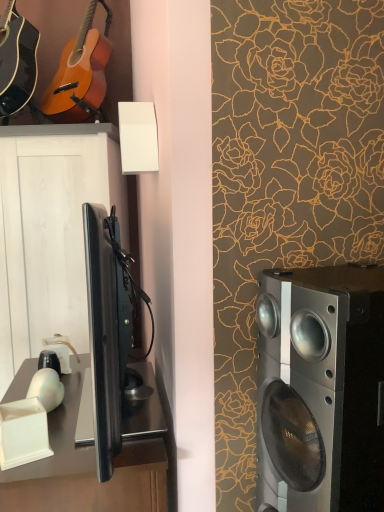
What do you see at coordinates (80, 74) in the screenshot? The height and width of the screenshot is (512, 384). I see `matte orange wood guitar at upper left, which is the 1th guitar from right to left` at bounding box center [80, 74].

The image size is (384, 512). Describe the element at coordinates (17, 61) in the screenshot. I see `matte black acoustic guitar at upper left, which is counted as the second guitar, starting from the right` at that location.

You are a GUI agent. You are given a task and a screenshot of the screen. Output one action in this format:
    pyautogui.click(x=<x>, y=<y>)
    Task: Click on the silver metallic speaker at right
    
    Given the screenshot: What is the action you would take?
    pyautogui.click(x=320, y=389)

Describe the element at coordinates (320, 389) in the screenshot. This screenshot has height=512, width=384. I see `silver metallic speaker at right` at that location.

Locate an element on the screen. satin black desk at lower left is located at coordinates pyautogui.click(x=86, y=468).

Does matte orange wood guitar at upper left, which is the 1th guitar from right to left, have a greater height compared to satin black desk at lower left?

In fact, matte orange wood guitar at upper left, which is the 1th guitar from right to left, may be shorter than satin black desk at lower left.

Does matte orange wood guitar at upper left, which is the 1th guitar from right to left, touch satin black desk at lower left?

matte orange wood guitar at upper left, which is the 1th guitar from right to left, is not next to satin black desk at lower left, and they're not touching.

Between matte orange wood guitar at upper left, the 2th guitar positioned from the left, and satin black desk at lower left, which one has smaller size?

matte orange wood guitar at upper left, the 2th guitar positioned from the left, is smaller.

Is matte orange wood guitar at upper left, the 2th guitar positioned from the left, inside or outside of satin black desk at lower left?

matte orange wood guitar at upper left, the 2th guitar positioned from the left, cannot be found inside satin black desk at lower left.

Based on the photo, is black glossy cabinet at left turned away from matte orange wood guitar at upper left, the 2th guitar positioned from the left?

No.

Is black glossy cabinet at left next to matte orange wood guitar at upper left, which is the 1th guitar from right to left, and touching it?

No, black glossy cabinet at left is not making contact with matte orange wood guitar at upper left, which is the 1th guitar from right to left.

Which object is closer to the camera, black glossy cabinet at left or matte orange wood guitar at upper left, the 2th guitar positioned from the left?

matte orange wood guitar at upper left, the 2th guitar positioned from the left, is in front.

Looking at the image, does black glossy cabinet at left seem bigger or smaller compared to matte orange wood guitar at upper left, which is the 1th guitar from right to left?

black glossy cabinet at left is bigger than matte orange wood guitar at upper left, which is the 1th guitar from right to left.

Is satin black desk at lower left turned away from silver metallic speaker at right?

Yes, satin black desk at lower left is facing away from silver metallic speaker at right.

Between satin black desk at lower left and silver metallic speaker at right, which one has larger width?

Wider between the two is satin black desk at lower left.

Would you say satin black desk at lower left is inside or outside silver metallic speaker at right?

satin black desk at lower left is spatially situated outside silver metallic speaker at right.

From the picture: Does satin black desk at lower left appear on the right side of silver metallic speaker at right?

No, satin black desk at lower left is not to the right of silver metallic speaker at right.

From a real-world perspective, who is located lower, satin black desk at lower left or black glossy cabinet at left?

satin black desk at lower left is physically lower.

Where is `cabinetry above the satin black desk at lower left (from the image's perspective)`? Image resolution: width=384 pixels, height=512 pixels. cabinetry above the satin black desk at lower left (from the image's perspective) is located at coordinates (50, 233).

Is satin black desk at lower left in contact with black glossy cabinet at left?

No, satin black desk at lower left is not making contact with black glossy cabinet at left.

Who is smaller, satin black desk at lower left or black glossy cabinet at left?

With smaller size is satin black desk at lower left.

From the image's perspective, between matte black acoustic guitar at upper left, marked as the first guitar in a left-to-right arrangement, and satin black desk at lower left, who is located below?

satin black desk at lower left, from the image's perspective.

In order to click on the 1st guitar behind the satin black desk at lower left, starting your count from the anchor in this screenshot , I will do `click(17, 61)`.

Is matte black acoustic guitar at upper left, marked as the first guitar in a left-to-right arrangement, positioned beyond the bounds of satin black desk at lower left?

Yes, matte black acoustic guitar at upper left, marked as the first guitar in a left-to-right arrangement, is not within satin black desk at lower left.

Is satin black desk at lower left at the back of matte black acoustic guitar at upper left, which is counted as the second guitar, starting from the right?

matte black acoustic guitar at upper left, which is counted as the second guitar, starting from the right, is not turned away from satin black desk at lower left.

Considering the sizes of objects matte orange wood guitar at upper left, which is the 1th guitar from right to left, and black glossy cabinet at left in the image provided, who is smaller, matte orange wood guitar at upper left, which is the 1th guitar from right to left, or black glossy cabinet at left?

matte orange wood guitar at upper left, which is the 1th guitar from right to left.

Does matte orange wood guitar at upper left, the 2th guitar positioned from the left, have a lesser height compared to black glossy cabinet at left?

Correct, matte orange wood guitar at upper left, the 2th guitar positioned from the left, is not as tall as black glossy cabinet at left.

How many degrees apart are the facing directions of matte orange wood guitar at upper left, which is the 1th guitar from right to left, and black glossy cabinet at left?

matte orange wood guitar at upper left, which is the 1th guitar from right to left, and black glossy cabinet at left are facing 1.27 degrees away from each other.

Which is behind, point (100, 45) or point (96, 164)?

The point (100, 45) is more distant.

From a real-world perspective, is matte orange wood guitar at upper left, which is the 1th guitar from right to left, physically located above or below matte black acoustic guitar at upper left, marked as the first guitar in a left-to-right arrangement?

matte orange wood guitar at upper left, which is the 1th guitar from right to left, is situated higher than matte black acoustic guitar at upper left, marked as the first guitar in a left-to-right arrangement, in the real world.

In terms of height, does matte orange wood guitar at upper left, the 2th guitar positioned from the left, look taller or shorter compared to matte black acoustic guitar at upper left, marked as the first guitar in a left-to-right arrangement?

In the image, matte orange wood guitar at upper left, the 2th guitar positioned from the left, appears to be taller than matte black acoustic guitar at upper left, marked as the first guitar in a left-to-right arrangement.

How much distance is there between matte orange wood guitar at upper left, which is the 1th guitar from right to left, and matte black acoustic guitar at upper left, marked as the first guitar in a left-to-right arrangement?

matte orange wood guitar at upper left, which is the 1th guitar from right to left, and matte black acoustic guitar at upper left, marked as the first guitar in a left-to-right arrangement, are 22.10 centimeters apart.

Is matte orange wood guitar at upper left, the 2th guitar positioned from the left, oriented away from matte black acoustic guitar at upper left, marked as the first guitar in a left-to-right arrangement?

No, matte orange wood guitar at upper left, the 2th guitar positioned from the left, is not facing away from matte black acoustic guitar at upper left, marked as the first guitar in a left-to-right arrangement.

Where is `the 2nd guitar located above the satin black desk at lower left (from a real-world perspective)`? This screenshot has width=384, height=512. the 2nd guitar located above the satin black desk at lower left (from a real-world perspective) is located at coordinates (80, 74).

The width and height of the screenshot is (384, 512). There is a black glossy cabinet at left. In order to click on the 2nd guitar above it (from the image's perspective) in this screenshot , I will do `click(80, 74)`.

Which object lies nearer to the anchor point matte orange wood guitar at upper left, which is the 1th guitar from right to left, satin black desk at lower left or silver metallic speaker at right?

satin black desk at lower left lies closer to matte orange wood guitar at upper left, which is the 1th guitar from right to left, than the other object.

When comparing their distances from satin black desk at lower left, does silver metallic speaker at right or black glossy cabinet at left seem closer?

silver metallic speaker at right is positioned closer to the anchor satin black desk at lower left.

Considering their positions, is matte orange wood guitar at upper left, which is the 1th guitar from right to left, positioned further to black glossy cabinet at left than silver metallic speaker at right?

silver metallic speaker at right is further to black glossy cabinet at left.

Considering their positions, is matte black acoustic guitar at upper left, marked as the first guitar in a left-to-right arrangement, positioned closer to matte orange wood guitar at upper left, which is the 1th guitar from right to left, than silver metallic speaker at right?

matte black acoustic guitar at upper left, marked as the first guitar in a left-to-right arrangement, lies closer to matte orange wood guitar at upper left, which is the 1th guitar from right to left, than the other object.

Considering their positions, is black glossy cabinet at left positioned closer to satin black desk at lower left than silver metallic speaker at right?

silver metallic speaker at right is closer to satin black desk at lower left.

Which object lies further to the anchor point black glossy cabinet at left, silver metallic speaker at right or matte orange wood guitar at upper left, which is the 1th guitar from right to left?

Based on the image, silver metallic speaker at right appears to be further to black glossy cabinet at left.

Which object lies nearer to the anchor point silver metallic speaker at right, satin black desk at lower left or matte black acoustic guitar at upper left, which is counted as the second guitar, starting from the right?

satin black desk at lower left is positioned closer to the anchor silver metallic speaker at right.

Looking at this image, looking at the image, which one is located further to satin black desk at lower left, silver metallic speaker at right or matte orange wood guitar at upper left, the 2th guitar positioned from the left?

matte orange wood guitar at upper left, the 2th guitar positioned from the left.

Identify the location of desk located between silver metallic speaker at right and black glossy cabinet at left in the depth direction. (86, 468).

Locate an element on the screen. Image resolution: width=384 pixels, height=512 pixels. home appliance between matte black acoustic guitar at upper left, marked as the first guitar in a left-to-right arrangement, and satin black desk at lower left vertically is located at coordinates (320, 389).

At what (x,y) coordinates should I click in order to perform the action: click on guitar between matte orange wood guitar at upper left, the 2th guitar positioned from the left, and satin black desk at lower left in the up-down direction. Please return your answer as a coordinate pair (x, y). The width and height of the screenshot is (384, 512). Looking at the image, I should click on (17, 61).

Locate an element on the screen. cabinetry that lies between matte orange wood guitar at upper left, the 2th guitar positioned from the left, and satin black desk at lower left from top to bottom is located at coordinates (50, 233).